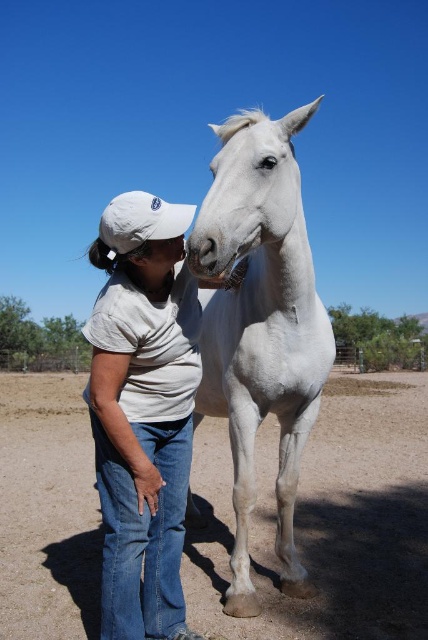
You are a photographer trying to capture a photo of the white cotton shirt at center and the white glossy horse at center. You want to ensure both are fully visible in the frame. Given their sizes, which object should you focus on to ensure the entire horse is in the shot without cropping?

The white cotton shirt at center has a lesser width compared to the white glossy horse at center, so you should focus on including the larger white glossy horse at center first to ensure it fits entirely within the frame.

You are standing in the outdoor scene and want to place a small flower pot exactly at point (303, 540). If the flower pot is 1.5 meters tall, will it be visible to someone standing 4 meters away from the point?

The distance of point (303, 540) from viewer is 3.81 meters. Since the flower pot is 1.5 meters tall and the viewer is only 3.81 meters away, the flower pot will be clearly visible to someone standing at that distance.

You are standing at the point labeled as point (56,394) in the image. You want to throw a ball to a friend who is standing 20 meters away from you. Is your friend within the visible range of the scene?

The point (56,394) and viewer are 18.32 meters apart from each other. Since your friend is 20 meters away, which is farther than 18.32 meters, your friend is outside the visible range of the scene.